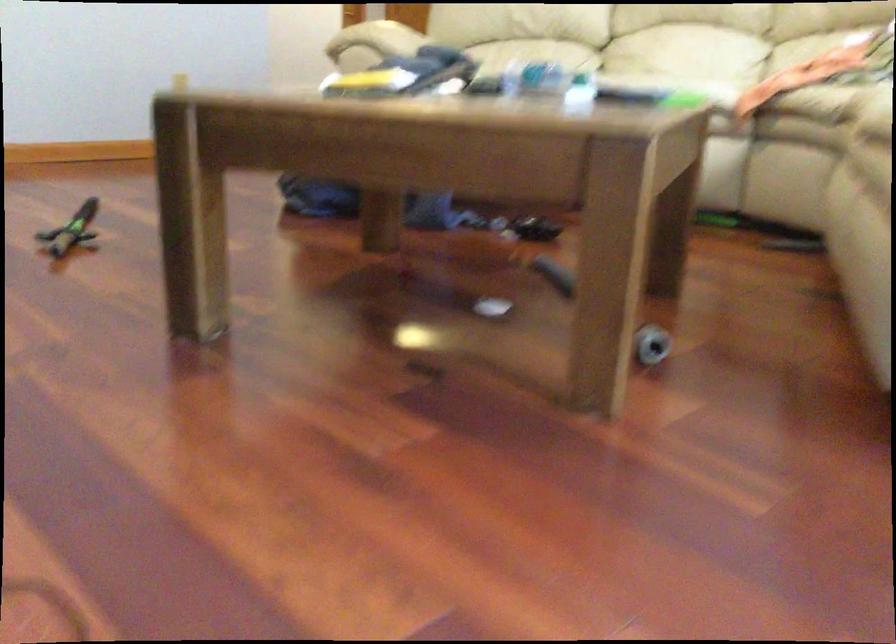
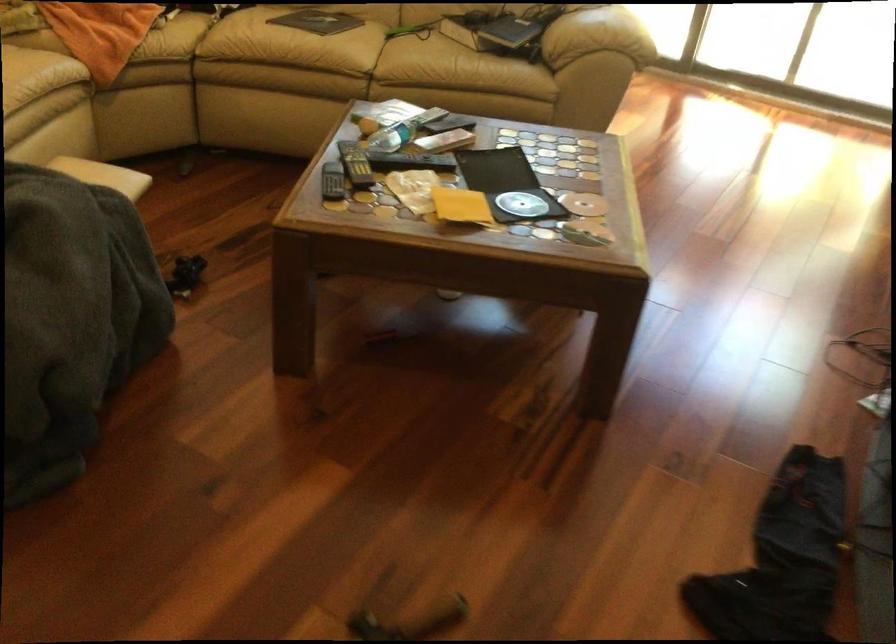
Locate, in the second image, the point that corresponds to [410,97] in the first image.

(506, 184)